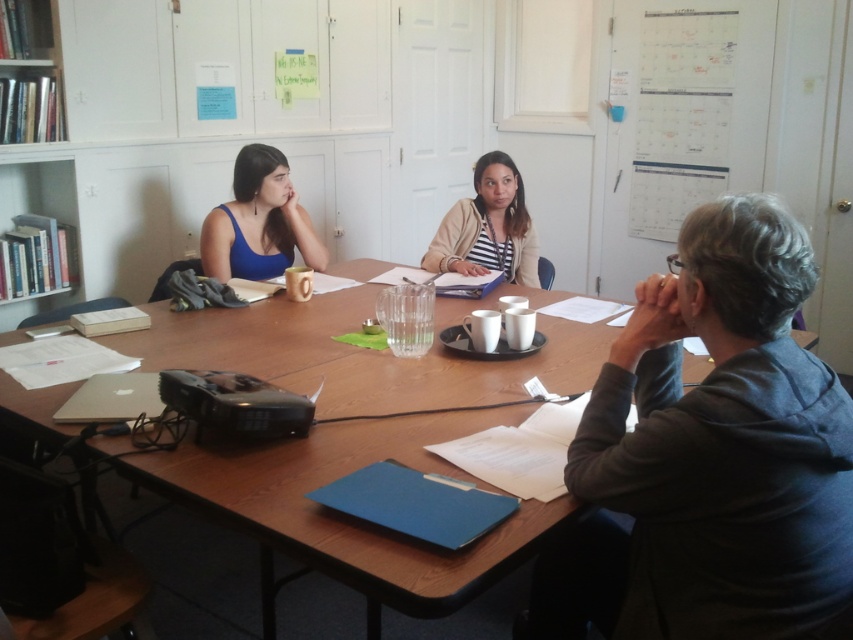
Question: Among these objects, which one is nearest to the camera?

Choices:
 (A) striped jersey shirt at center
 (B) matte blue tank top at left
 (C) gray cotton hoodie at lower right

Answer: (C)

Question: Is white paper calendar at upper right thinner than striped jersey shirt at center?

Choices:
 (A) no
 (B) yes

Answer: (B)

Question: Which point appears closest to the camera in this image?

Choices:
 (A) (468, 205)
 (B) (650, 221)
 (C) (308, 227)

Answer: (C)

Question: Can you confirm if matte blue tank top at left is bigger than striped jersey shirt at center?

Choices:
 (A) no
 (B) yes

Answer: (A)

Question: Is wooden table at center smaller than matte blue tank top at left?

Choices:
 (A) no
 (B) yes

Answer: (A)

Question: Which of the following is the closest to the observer?

Choices:
 (A) (654, 634)
 (B) (303, 342)
 (C) (505, 244)
 (D) (654, 35)

Answer: (A)